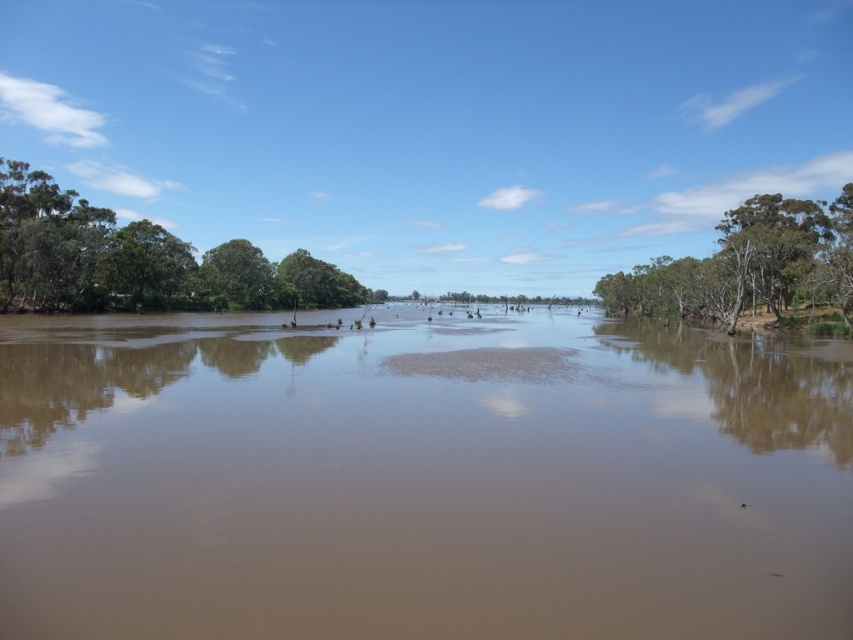
You are standing on the bank of the waterway and notice the brown muddy water at center and the green leafy trees at left. Which object is closer to the water surface?

The brown muddy water at center is closer to the water surface than the green leafy trees at left because it is located below them.

You are standing on a boat in the center of the waterway. Which side should you paddle towards to get closer to the green leafy trees at left and the green leafy tree at right?

You should paddle towards the left side to get closer to the green leafy trees at left and the right side to get closer to the green leafy tree at right since the green leafy trees at left are positioned to the left of the green leafy tree at right.

You are standing on the bank of the river and want to cross to the other side. The brown muddy water at center is below the green leafy tree at right. Which direction should you avoid to prevent stepping into the muddy water?

You should avoid going towards the direction of the green leafy tree at right because the brown muddy water at center is located below it, meaning the muddy area is directly beneath that tree.